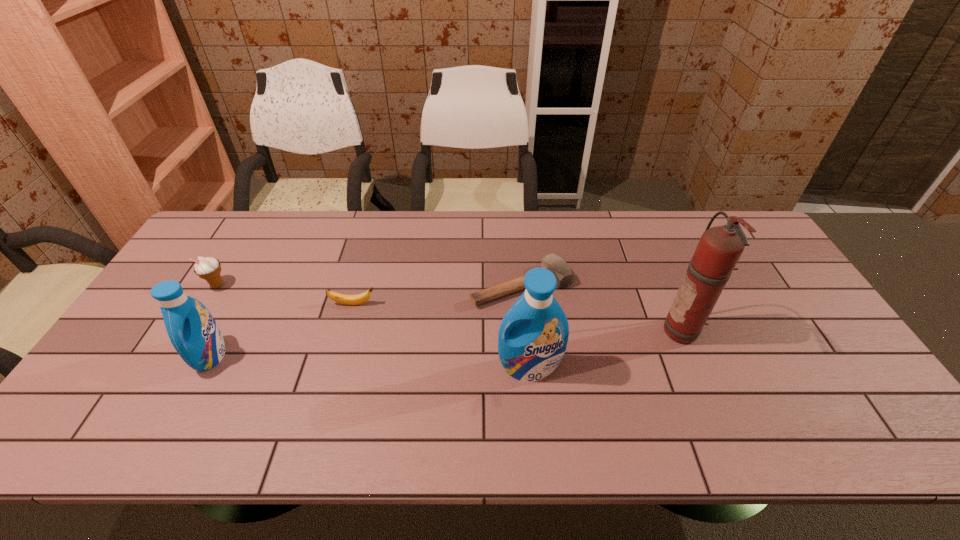
At what (x,y) coordinates should I click in order to perform the action: click on free area in between the third shortest object and the fifth shortest object. Please return your answer as a coordinate pair (x, y). Image resolution: width=960 pixels, height=540 pixels. Looking at the image, I should click on pos(373,327).

The width and height of the screenshot is (960, 540). I want to click on empty space that is in between the right detergent and the tallest object, so click(x=607, y=349).

Identify the location of object that can be found as the fifth closest to the rightmost object. (209, 268).

Identify which object is located as the fourth nearest to the fifth shortest object. Please provide its 2D coordinates. Your answer should be formatted as a tuple, i.e. [(x, y)], where the tuple contains the x and y coordinates of a point satisfying the conditions above.

[(192, 330)]